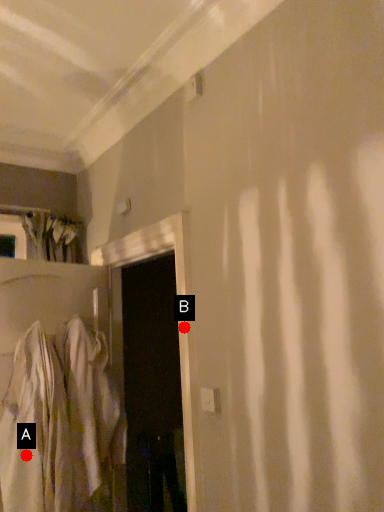
Question: Two points are circled on the image, labeled by A and B beside each circle. Which point appears closest to the camera in this image?

Choices:
 (A) A is closer
 (B) B is closer

Answer: (A)